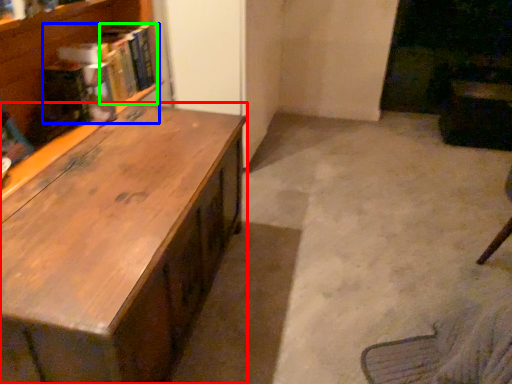
Question: Which is farther away from desk (highlighted by a red box)? book (highlighted by a blue box) or book (highlighted by a green box)?

Choices:
 (A) book
 (B) book

Answer: (B)